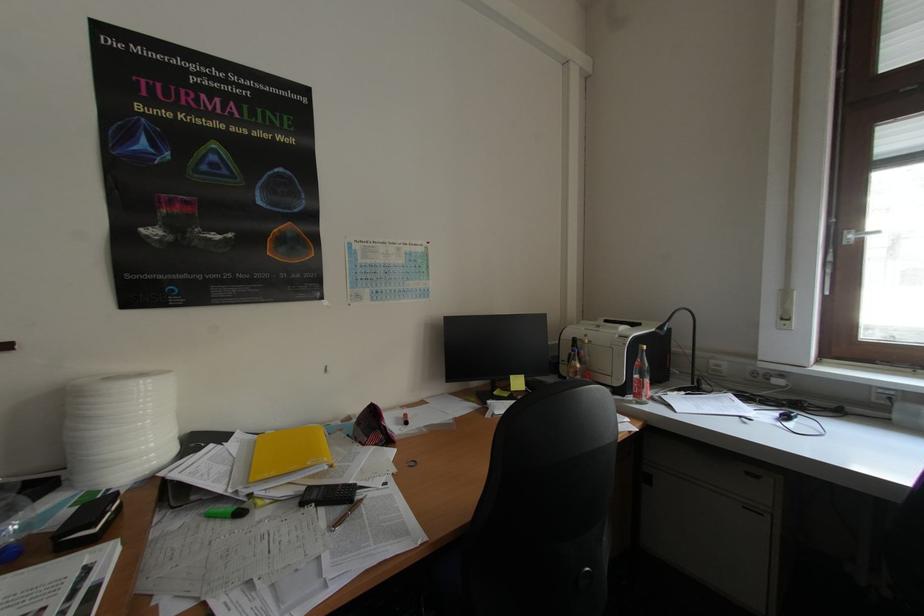
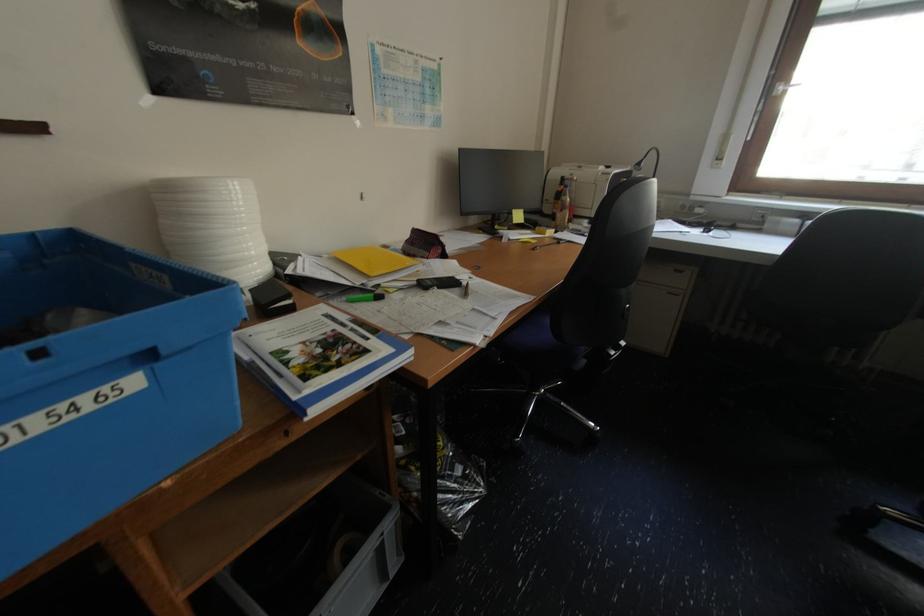
Find the pixel in the second image that matches point (579, 341) in the first image.

(568, 180)